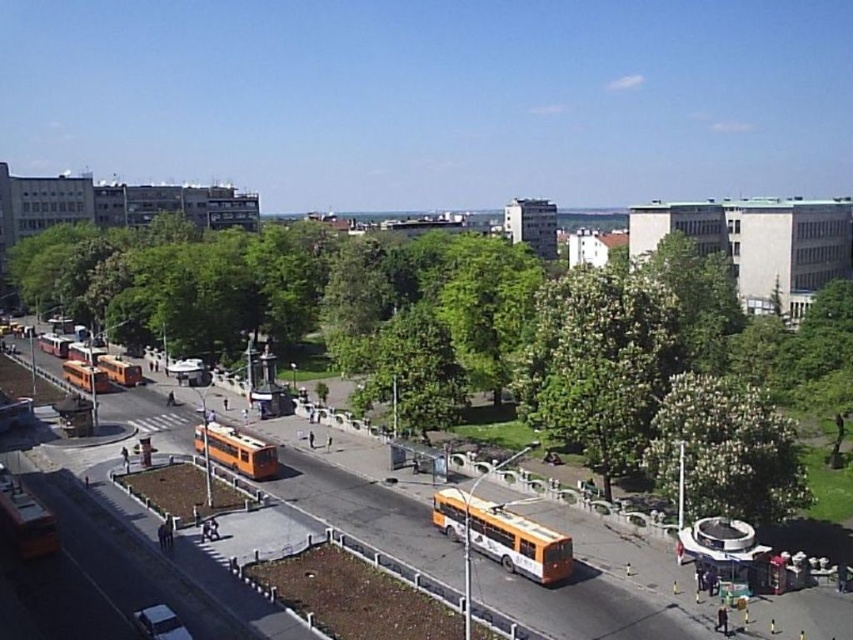
Does white fluffy tree at right have a greater width compared to orange matte bus at center-left?

In fact, white fluffy tree at right might be narrower than orange matte bus at center-left.

Who is higher up, white fluffy tree at right or orange matte bus at center-left?

Positioned higher is orange matte bus at center-left.

The image size is (853, 640). What do you see at coordinates (724, 451) in the screenshot? I see `white fluffy tree at right` at bounding box center [724, 451].

The width and height of the screenshot is (853, 640). I want to click on white fluffy tree at right, so click(x=724, y=451).

Does orange matte bus at center appear on the left side of orange matte bus at center-left?

No, orange matte bus at center is not to the left of orange matte bus at center-left.

Is orange matte bus at center above orange matte bus at center-left?

No, orange matte bus at center is not above orange matte bus at center-left.

Identify the location of orange matte bus at center. (120, 371).

Does orange matte school bus at lower center appear on the left side of orange matte bus at left?

Incorrect, orange matte school bus at lower center is not on the left side of orange matte bus at left.

Which is in front, point (544, 541) or point (90, 388)?

Point (544, 541) is more forward.

Does point (531, 540) come in front of point (96, 387)?

Yes.

Locate an element on the screen. The width and height of the screenshot is (853, 640). orange matte school bus at lower center is located at coordinates (503, 536).